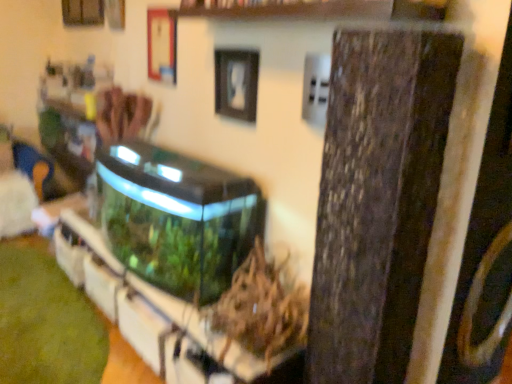
Question: Can you confirm if transparent glass water tank at center is positioned to the right of transparent glass aquarium at center, acting as the second shelf starting from the top?

Choices:
 (A) yes
 (B) no

Answer: (A)

Question: Could you tell me if transparent glass water tank at center is turned towards transparent glass aquarium at center, acting as the second shelf starting from the top?

Choices:
 (A) no
 (B) yes

Answer: (A)

Question: From the image's perspective, is transparent glass water tank at center below transparent glass aquarium at center, acting as the second shelf starting from the top?

Choices:
 (A) yes
 (B) no

Answer: (B)

Question: Considering the relative sizes of transparent glass water tank at center and transparent glass aquarium at center, acting as the first shelf starting from the bottom, in the image provided, is transparent glass water tank at center smaller than transparent glass aquarium at center, acting as the first shelf starting from the bottom,?

Choices:
 (A) no
 (B) yes

Answer: (A)

Question: Can you confirm if transparent glass water tank at center is wider than transparent glass aquarium at center, acting as the first shelf starting from the bottom?

Choices:
 (A) yes
 (B) no

Answer: (A)

Question: Looking at the image, does green matte plant at center seem bigger or smaller compared to wooden at upper center, which is the 2th shelf from bottom to top?

Choices:
 (A) big
 (B) small

Answer: (A)

Question: Considering the relative positions of green matte plant at center and wooden at upper center, the first shelf positioned from the top, in the image provided, is green matte plant at center to the left or to the right of wooden at upper center, the first shelf positioned from the top,?

Choices:
 (A) left
 (B) right

Answer: (A)

Question: Is point (258, 274) positioned closer to the camera than point (247, 13)?

Choices:
 (A) closer
 (B) farther

Answer: (B)

Question: From the image's perspective, is green matte plant at center above or below wooden at upper center, which is the 2th shelf from bottom to top?

Choices:
 (A) below
 (B) above

Answer: (A)

Question: From the image's perspective, is black matte picture frame at upper center positioned above or below transparent glass water tank at center?

Choices:
 (A) above
 (B) below

Answer: (A)

Question: In the image, is black matte picture frame at upper center on the left side or the right side of transparent glass water tank at center?

Choices:
 (A) right
 (B) left

Answer: (A)

Question: Considering the positions of point (252, 109) and point (183, 213), is point (252, 109) closer or farther from the camera than point (183, 213)?

Choices:
 (A) farther
 (B) closer

Answer: (A)

Question: Considering the positions of black matte picture frame at upper center and transparent glass water tank at center in the image, is black matte picture frame at upper center taller or shorter than transparent glass water tank at center?

Choices:
 (A) short
 (B) tall

Answer: (A)

Question: From the image's perspective, is green matte plant at center located above or below transparent glass water tank at center?

Choices:
 (A) below
 (B) above

Answer: (A)

Question: From a real-world perspective, is green matte plant at center physically located above or below transparent glass water tank at center?

Choices:
 (A) above
 (B) below

Answer: (B)